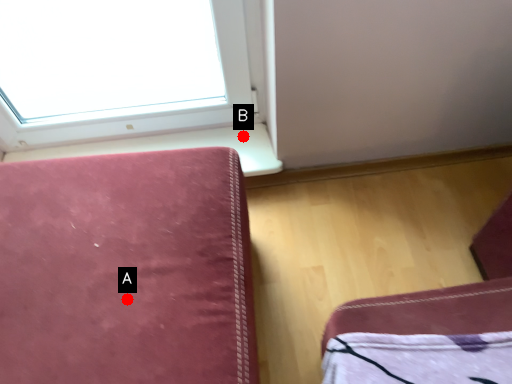
Question: Two points are circled on the image, labeled by A and B beside each circle. Which point is farther from the camera taking this photo?

Choices:
 (A) A is further
 (B) B is further

Answer: (B)